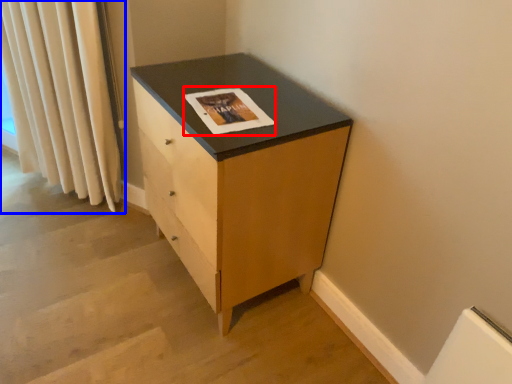
Question: Which object is closer to the camera taking this photo, magazine (highlighted by a red box) or curtain (highlighted by a blue box)?

Choices:
 (A) magazine
 (B) curtain

Answer: (A)